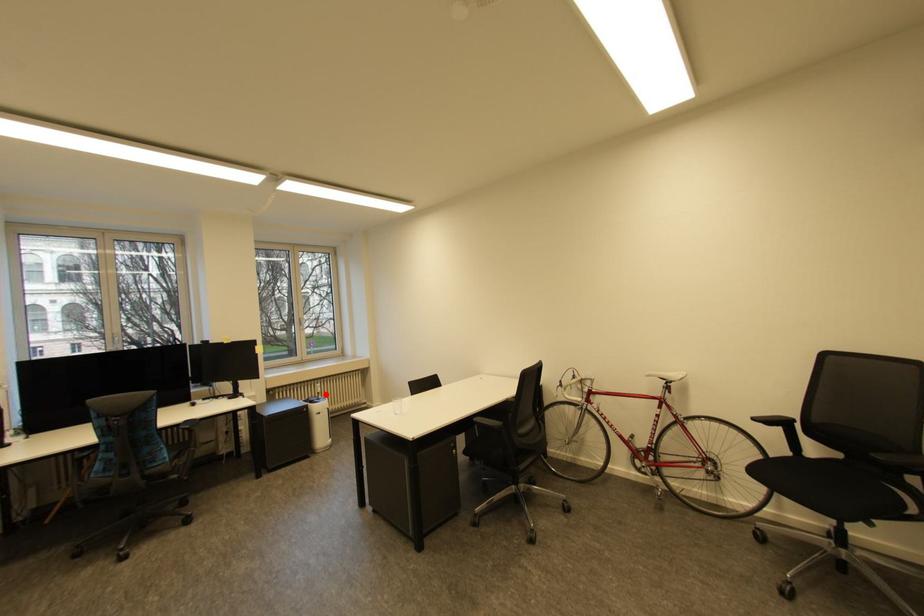
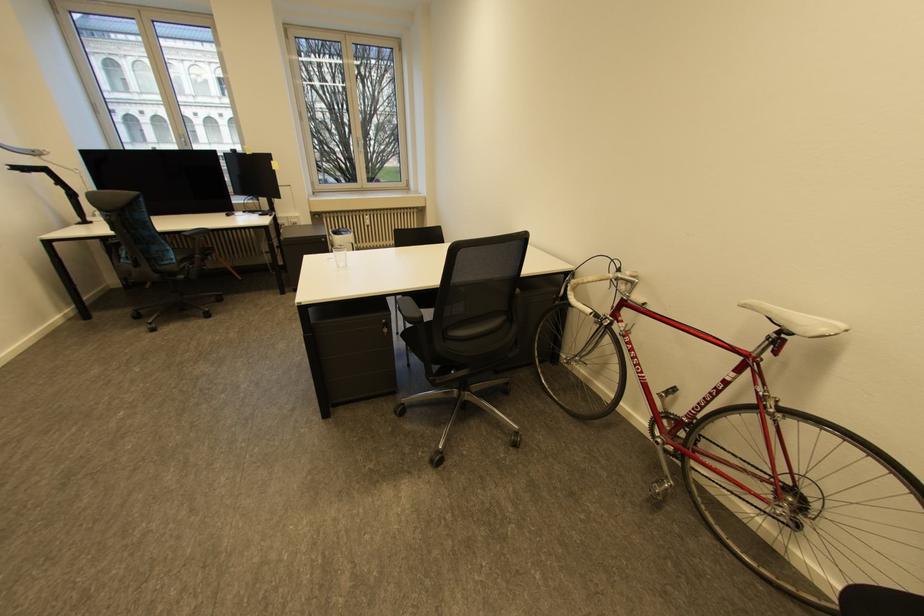
The point at the highlighted location is marked in the first image. Where is the corresponding point in the second image?

(374, 227)